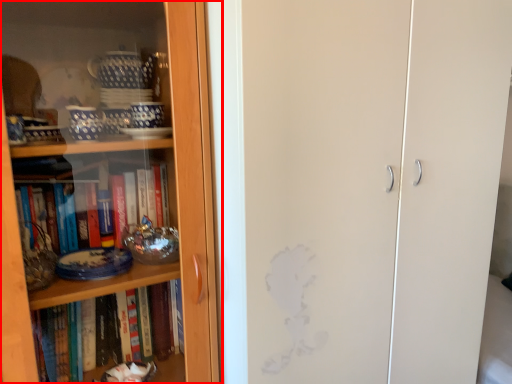
Question: From the image's perspective, where is bookcase (annotated by the red box) located in relation to screen door in the image?

Choices:
 (A) below
 (B) above

Answer: (B)